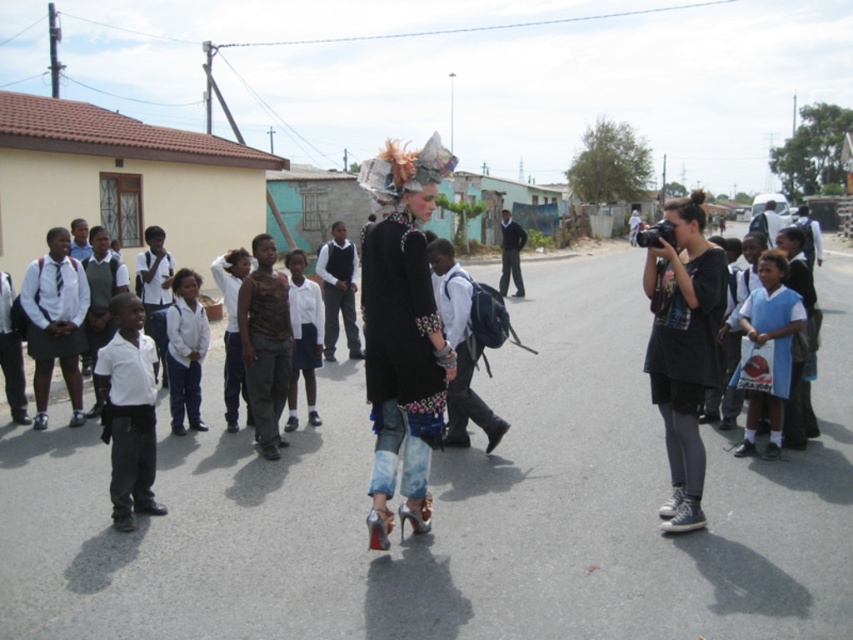
Consider the image. What is the color of the shirt worn by the child located at the coordinates point (128,412)?

The point (128,412) indicates white smooth shirt at left.

You are a photographer trying to capture both the white smooth shirt at left and the white uniform at center in a single shot. Which one should you focus on first to ensure both are in frame?

The white smooth shirt at left is bigger than the white uniform at center, so you should focus on the white smooth shirt at left first to ensure both are in frame.

You are a pedestrian standing on the sidewalk and see the white cotton shirt at left and the dark gray pants at center. Which one is closer to your left side?

The white cotton shirt at left is closer to your left side because it is positioned to the left of the dark gray pants at center.